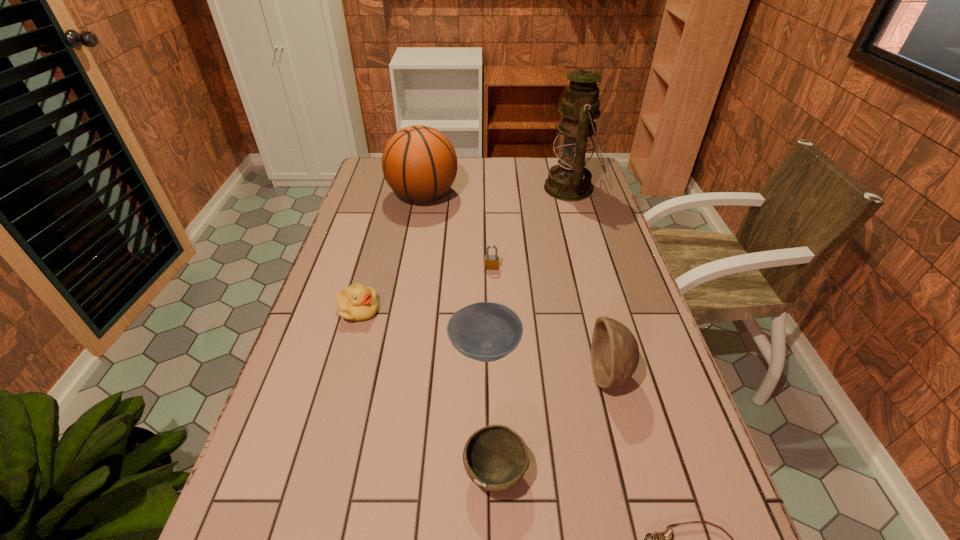
Locate an element on the screen. The height and width of the screenshot is (540, 960). the tallest object is located at coordinates (569, 180).

Find the location of a particular element. The width and height of the screenshot is (960, 540). the second tallest object is located at coordinates (419, 163).

Identify the location of the third tallest object. (614, 350).

Locate an element on the screen. the tallest bowl is located at coordinates (614, 350).

At what (x,y) coordinates should I click in order to perform the action: click on duckling. Please return your answer as a coordinate pair (x, y). This screenshot has width=960, height=540. Looking at the image, I should click on (357, 303).

The image size is (960, 540). What are the coordinates of `the third farthest object` in the screenshot? It's located at (491, 261).

Identify the location of the second nearest object. (495, 457).

Identify the location of vacant area located 0.300m on the front of the oil lamp. (593, 265).

The width and height of the screenshot is (960, 540). Find the location of `vacant point located 0.050m on the front of the seventh shortest object`. vacant point located 0.050m on the front of the seventh shortest object is located at coordinates click(x=418, y=224).

Identify the location of free space located on the front of the third tallest object. (623, 426).